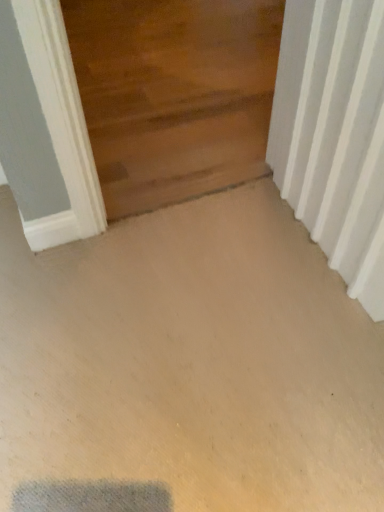
Question: Can you confirm if wooden door at upper center is positioned to the left of white textured radiator at right?

Choices:
 (A) no
 (B) yes

Answer: (B)

Question: Are wooden door at upper center and white textured radiator at right beside each other?

Choices:
 (A) yes
 (B) no

Answer: (B)

Question: From a real-world perspective, is wooden door at upper center physically above white textured radiator at right?

Choices:
 (A) no
 (B) yes

Answer: (A)

Question: Is wooden door at upper center facing away from white textured radiator at right?

Choices:
 (A) yes
 (B) no

Answer: (B)

Question: From the image's perspective, does wooden door at upper center appear higher than white textured radiator at right?

Choices:
 (A) no
 (B) yes

Answer: (B)

Question: Can you confirm if wooden door at upper center is bigger than white textured radiator at right?

Choices:
 (A) yes
 (B) no

Answer: (A)

Question: Can you confirm if white textured radiator at right is shorter than wooden door at upper center?

Choices:
 (A) no
 (B) yes

Answer: (A)

Question: Is wooden door at upper center at the back of white textured radiator at right?

Choices:
 (A) no
 (B) yes

Answer: (A)

Question: From the image's perspective, does white textured radiator at right appear higher than wooden door at upper center?

Choices:
 (A) no
 (B) yes

Answer: (A)

Question: Is white textured radiator at right positioned beyond the bounds of wooden door at upper center?

Choices:
 (A) yes
 (B) no

Answer: (A)

Question: Is wooden door at upper center a part of white textured radiator at right?

Choices:
 (A) yes
 (B) no

Answer: (B)

Question: Is white textured radiator at right positioned behind wooden door at upper center?

Choices:
 (A) no
 (B) yes

Answer: (A)

Question: Visually, is wooden door at upper center positioned to the left or to the right of white textured radiator at right?

Choices:
 (A) left
 (B) right

Answer: (A)